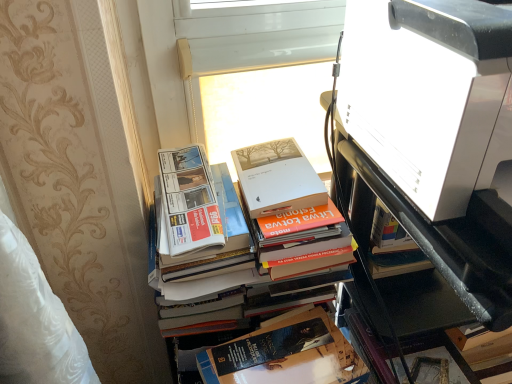
Question: From the image's perspective, is white plastic window screen at upper center above or below white glossy printer at upper right?

Choices:
 (A) below
 (B) above

Answer: (B)

Question: Which is correct: white plastic window screen at upper center is inside white glossy printer at upper right, or outside of it?

Choices:
 (A) inside
 (B) outside

Answer: (B)

Question: Which of these objects is positioned farthest from the white glossy printer at upper right?

Choices:
 (A) hardcover book at center
 (B) white glossy printer at upper right
 (C) white plastic window screen at upper center

Answer: (C)

Question: Considering the real-world distances, which object is farthest from the white glossy printer at upper right?

Choices:
 (A) white plastic window screen at upper center
 (B) white glossy printer at upper right
 (C) hardcover book at center

Answer: (A)